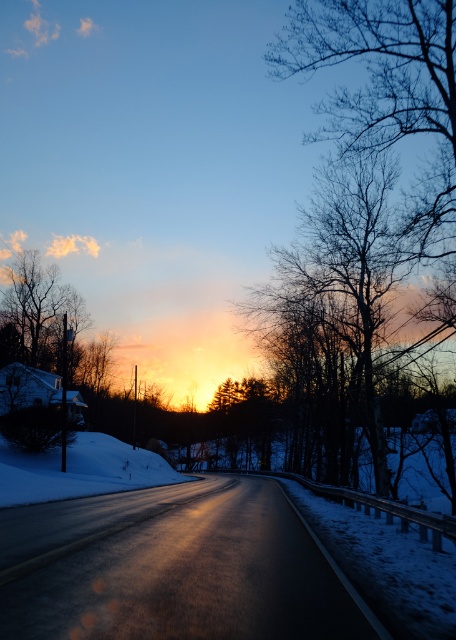
Is point (331, 160) farther from camera compared to point (67, 458)?

Yes, point (331, 160) is farther from viewer.

Identify the location of bare branches at center. (357, 339).

Locate an element on the screen. The image size is (456, 640). bare branches at center is located at coordinates (357, 339).

Who is lower down, white powdery snow at lower left or silhouette bare tree at upper left?

white powdery snow at lower left

Does point (176, 481) lie behind point (72, 326)?

No, it is in front of (72, 326).

Who is more forward, (109, 467) or (25, 253)?

Point (109, 467) is in front.

Identify the location of white powdery snow at lower left. (79, 470).

Looking at this image, which is more to the right, bare branches at center or silhouette bare tree at upper left?

bare branches at center is more to the right.

Does bare branches at center appear on the left side of silhouette bare tree at upper left?

No, bare branches at center is not to the left of silhouette bare tree at upper left.

The image size is (456, 640). What do you see at coordinates (357, 339) in the screenshot?
I see `bare branches at center` at bounding box center [357, 339].

Locate an element on the screen. The height and width of the screenshot is (640, 456). bare branches at center is located at coordinates (357, 339).